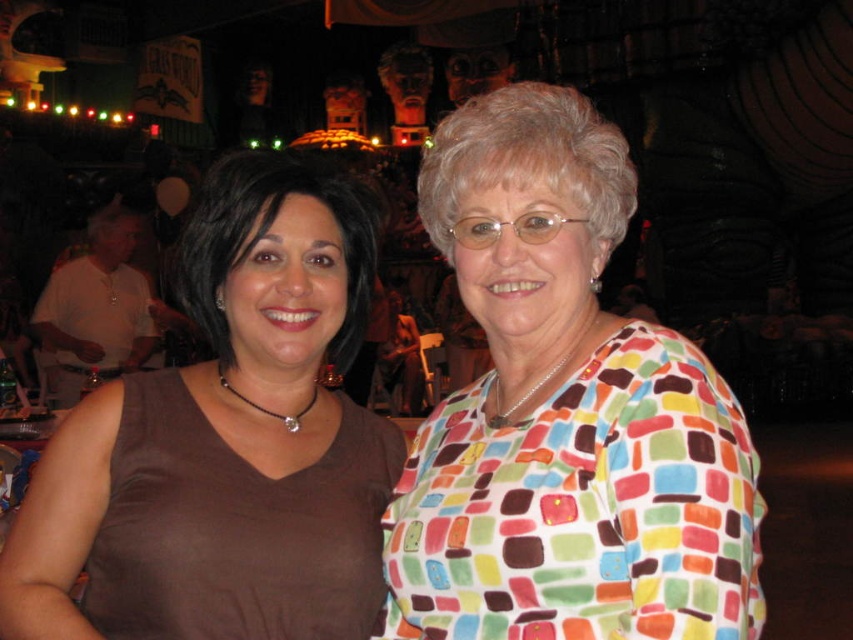
Which is above, multicolored fabric blouse at center or matte brown tank top at left?

Positioned higher is multicolored fabric blouse at center.

Does point (636, 560) come closer to viewer compared to point (320, 417)?

Yes, point (636, 560) is in front of point (320, 417).

What are the coordinates of `multicolored fabric blouse at center` in the screenshot? It's located at (564, 413).